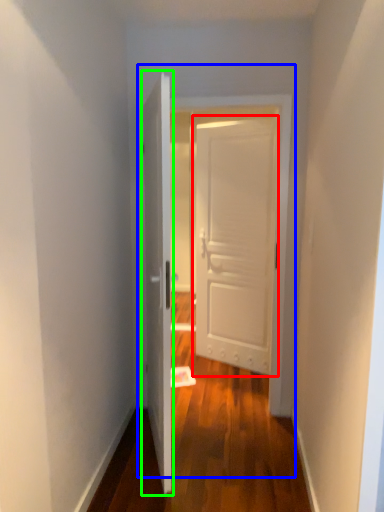
Question: Considering the real-world distances, which object is closest to door (highlighted by a red box)? door (highlighted by a blue box) or door (highlighted by a green box).

Choices:
 (A) door
 (B) door

Answer: (A)